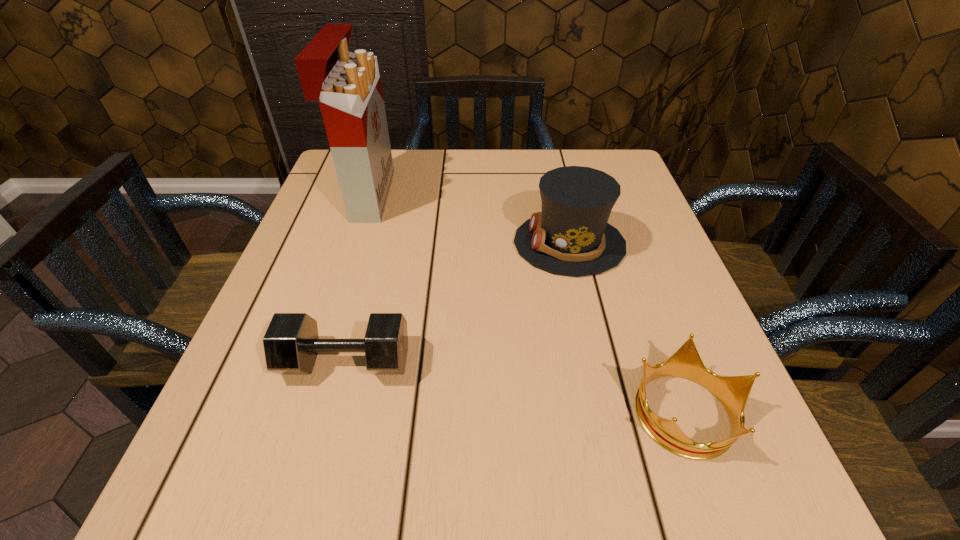
Where is `vacant area between the crown and the dress hat`? The height and width of the screenshot is (540, 960). vacant area between the crown and the dress hat is located at coordinates (627, 327).

Where is `free point between the dumbbell and the cigarette case`? The width and height of the screenshot is (960, 540). free point between the dumbbell and the cigarette case is located at coordinates (357, 279).

Locate an element on the screen. The height and width of the screenshot is (540, 960). unoccupied position between the crown and the dumbbell is located at coordinates (516, 386).

Identify the location of unoccupied area between the third shortest object and the cigarette case. Image resolution: width=960 pixels, height=540 pixels. (468, 220).

Locate which object is the second closest to the dress hat. Please provide its 2D coordinates. Your answer should be formatted as a tuple, i.e. [(x, y)], where the tuple contains the x and y coordinates of a point satisfying the conditions above.

[(291, 343)]

You are a GUI agent. You are given a task and a screenshot of the screen. Output one action in this format:
    pyautogui.click(x=<x>, y=<y>)
    Task: Click on the second closest object to the crown
    This screenshot has height=540, width=960.
    Given the screenshot: What is the action you would take?
    pyautogui.click(x=291, y=343)

Identify the location of blank space that satisfies the following two spatial constraints: 1. with the lid open on the tallest object; 2. on the right side of the dumbbell. (315, 361).

Image resolution: width=960 pixels, height=540 pixels. Identify the location of vacant space that satisfies the following two spatial constraints: 1. with goggles on the front of the second tallest object; 2. on the left side of the crown. (608, 411).

Find the location of a particular element. free space that satisfies the following two spatial constraints: 1. with the lid open on the cigarette case; 2. on the left side of the crown is located at coordinates (299, 411).

The height and width of the screenshot is (540, 960). I want to click on free spot that satisfies the following two spatial constraints: 1. with the lid open on the dumbbell; 2. on the left side of the cigarette case, so click(x=315, y=361).